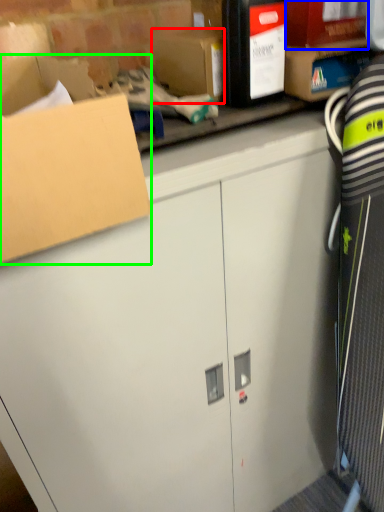
Question: Which object is the farthest from storage box (highlighted by a red box)? Choose among these: storage box (highlighted by a blue box) or box (highlighted by a green box).

Choices:
 (A) storage box
 (B) box

Answer: (B)